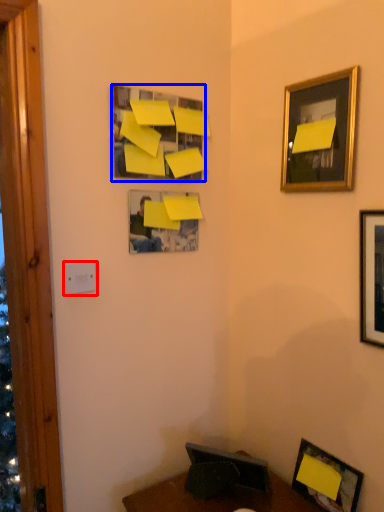
Question: Which point is further to the camera, light switch (highlighted by a red box) or picture frame (highlighted by a blue box)?

Choices:
 (A) light switch
 (B) picture frame

Answer: (B)